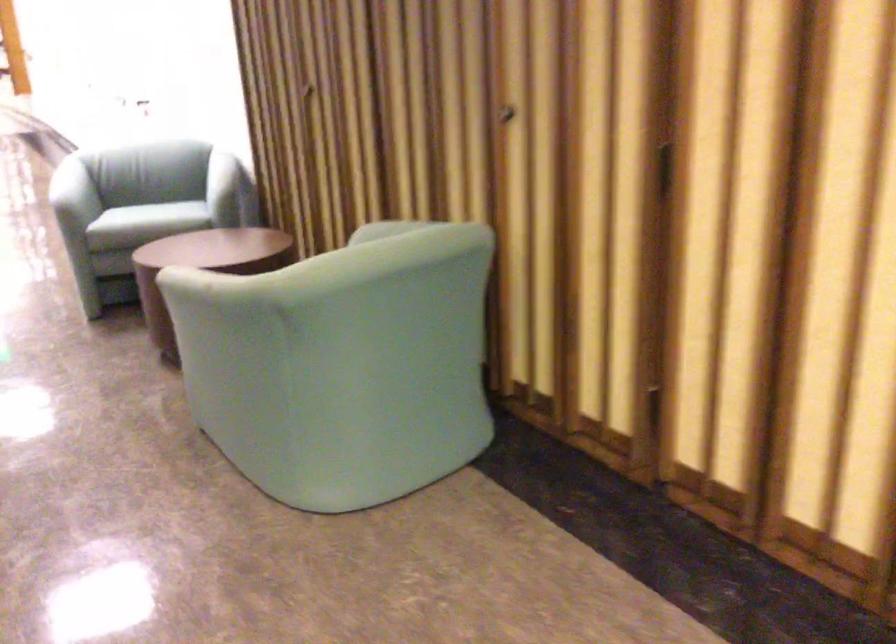
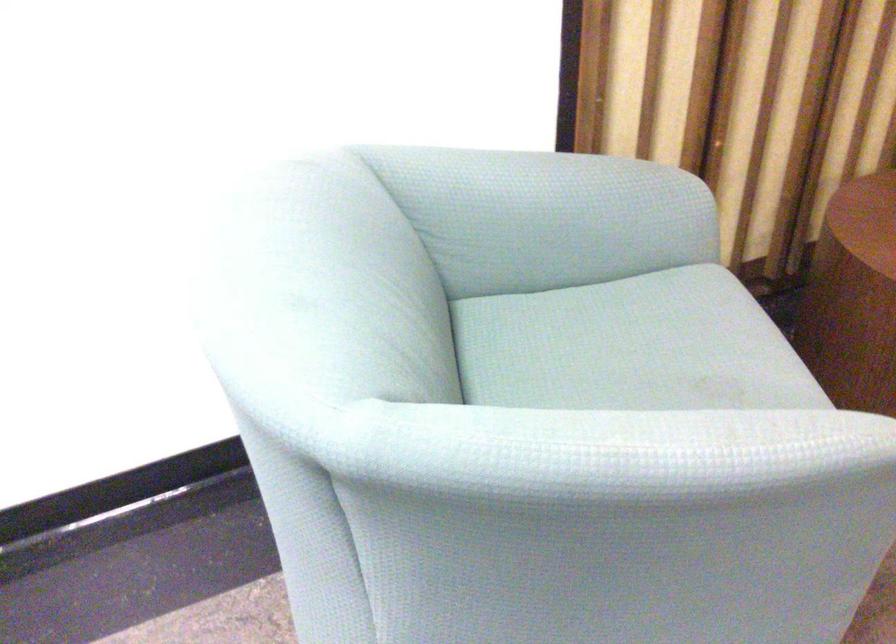
Where in the second image is the point corresponding to point 143,196 from the first image?

(631, 346)